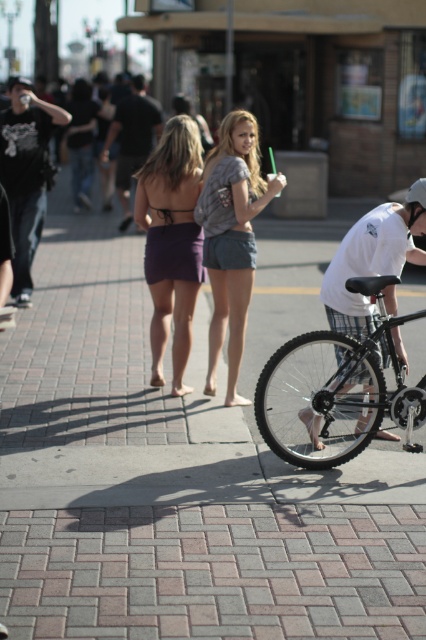
You are standing at the point with coordinates point (126, 125) and want to walk towards the point with coordinates point (244, 296). Which direction should you move relative to your current position?

You should move forward because point (244, 296) is closer to the camera than point (126, 125), so it is in front of you.